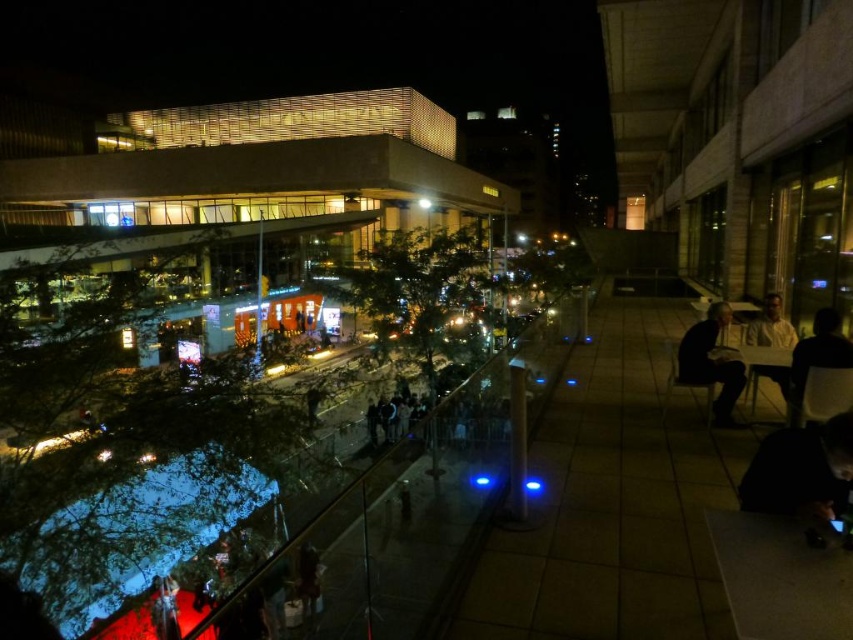
You are standing at the center of the tiled floor in the foreground of the image. You need to place a new decorative lamp at the exact location where the dark fabric bag at lower right is currently positioned. What are the coordinates of the point where you should place the lamp?

The dark fabric bag at lower right is located at coordinates point (801, 472), so you should place the decorative lamp at point (801, 472).

You are standing on an elevated outdoor seating area at night. You see a dark fabric bag at lower right and a dark gray fabric jacket at right. Which object is positioned more to the left?

The dark fabric bag at lower right is positioned to the left of the dark gray fabric jacket at right, so the dark fabric bag at lower right is more to the left.